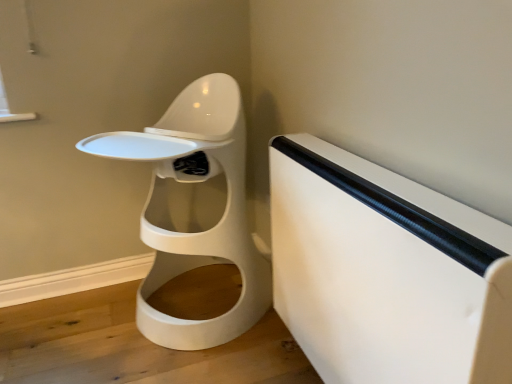
Question: Does white matte toilet at center have a greater height compared to white matte changing table at right?

Choices:
 (A) yes
 (B) no

Answer: (A)

Question: Is the depth of white matte toilet at center less than that of white matte changing table at right?

Choices:
 (A) no
 (B) yes

Answer: (A)

Question: Can you see white matte toilet at center touching white matte changing table at right?

Choices:
 (A) no
 (B) yes

Answer: (A)

Question: Is white matte toilet at center wider than white matte changing table at right?

Choices:
 (A) no
 (B) yes

Answer: (B)

Question: From a real-world perspective, is white matte toilet at center positioned under white matte changing table at right based on gravity?

Choices:
 (A) yes
 (B) no

Answer: (B)

Question: Is white matte toilet at center oriented away from white matte changing table at right?

Choices:
 (A) yes
 (B) no

Answer: (B)

Question: Can you confirm if white matte changing table at right is positioned to the right of white matte toilet at center?

Choices:
 (A) yes
 (B) no

Answer: (A)

Question: Does white matte changing table at right have a greater height compared to white matte toilet at center?

Choices:
 (A) yes
 (B) no

Answer: (B)

Question: From a real-world perspective, is white matte changing table at right beneath white matte toilet at center?

Choices:
 (A) no
 (B) yes

Answer: (B)

Question: From the image's perspective, does white matte changing table at right appear lower than white matte toilet at center?

Choices:
 (A) no
 (B) yes

Answer: (B)

Question: Is white matte changing table at right oriented towards white matte toilet at center?

Choices:
 (A) no
 (B) yes

Answer: (A)

Question: Would you say white matte changing table at right is a long distance from white matte toilet at center?

Choices:
 (A) no
 (B) yes

Answer: (A)

Question: Does point (479, 284) appear closer or farther from the camera than point (225, 231)?

Choices:
 (A) farther
 (B) closer

Answer: (B)